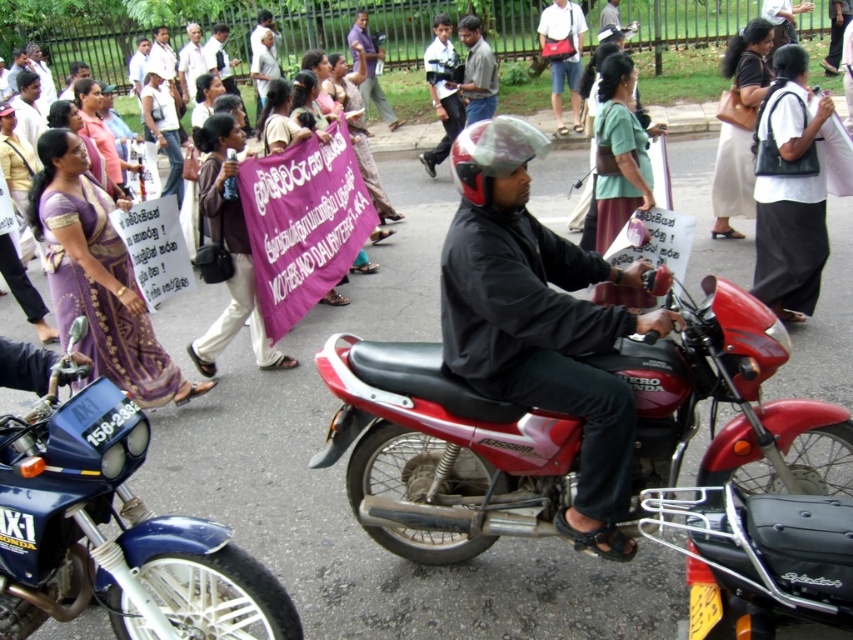
Can you confirm if red matte motorcycle at center is thinner than matte black helmet at center?

No, red matte motorcycle at center is not thinner than matte black helmet at center.

Where is `red matte motorcycle at center`? red matte motorcycle at center is located at coordinates (440, 452).

Is point (393, 531) closer to viewer compared to point (506, 116)?

That is True.

This screenshot has height=640, width=853. I want to click on red matte motorcycle at center, so click(440, 452).

Can you confirm if blue metallic motorcycle at lower left is thinner than matte black helmet at center?

No, blue metallic motorcycle at lower left is not thinner than matte black helmet at center.

Where is `blue metallic motorcycle at lower left`? This screenshot has width=853, height=640. blue metallic motorcycle at lower left is located at coordinates (107, 522).

Which is behind, point (194, 632) or point (572, 502)?

The point (572, 502) is more distant.

Find the location of a particular element. Image resolution: width=853 pixels, height=640 pixels. blue metallic motorcycle at lower left is located at coordinates (107, 522).

Which is more to the right, red matte motorcycle at center or blue metallic motorcycle at lower left?

red matte motorcycle at center

Is red matte motorcycle at center below blue metallic motorcycle at lower left?

Incorrect, red matte motorcycle at center is not positioned below blue metallic motorcycle at lower left.

Identify the location of red matte motorcycle at center. The image size is (853, 640). (440, 452).